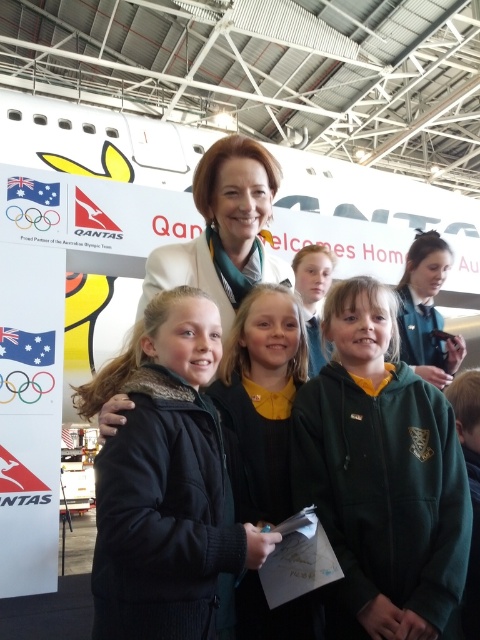
Who is more forward, [180,552] or [236,456]?

Point [180,552]

Can you confirm if black fuzzy jacket at center is positioned to the left of black woolen sweater at center?

Correct, you'll find black fuzzy jacket at center to the left of black woolen sweater at center.

Describe the element at coordinates (167, 484) in the screenshot. I see `black fuzzy jacket at center` at that location.

Where is `black fuzzy jacket at center`? This screenshot has width=480, height=640. black fuzzy jacket at center is located at coordinates (167, 484).

Does green fleece jacket at center have a smaller size compared to green fleece jacket at lower right?

Indeed, green fleece jacket at center has a smaller size compared to green fleece jacket at lower right.

Can you confirm if green fleece jacket at center is positioned to the left of green fleece jacket at lower right?

Correct, you'll find green fleece jacket at center to the left of green fleece jacket at lower right.

The image size is (480, 640). What do you see at coordinates (381, 476) in the screenshot?
I see `green fleece jacket at center` at bounding box center [381, 476].

The height and width of the screenshot is (640, 480). Identify the location of green fleece jacket at center. (381, 476).

Which is below, black woolen sweater at center or smooth yellow hair at center?

black woolen sweater at center is lower down.

Can you confirm if black woolen sweater at center is taller than smooth yellow hair at center?

Indeed, black woolen sweater at center has a greater height compared to smooth yellow hair at center.

Where is `black woolen sweater at center`? black woolen sweater at center is located at coordinates (261, 401).